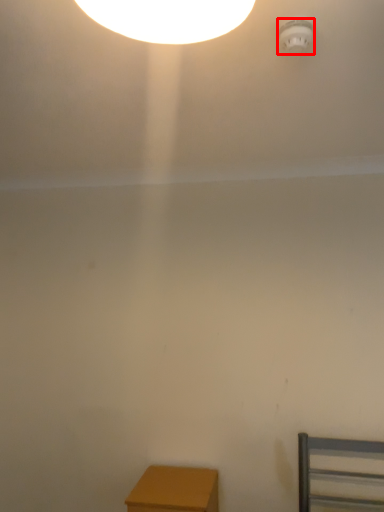
Question: From the image's perspective, what is the correct spatial relationship of lamp (annotated by the red box) in relation to furniture?

Choices:
 (A) below
 (B) above

Answer: (B)